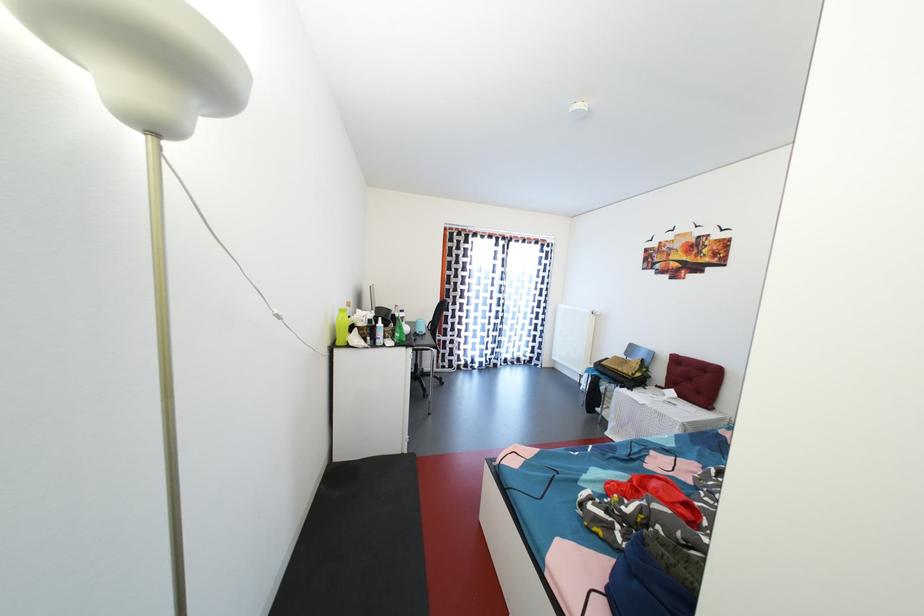
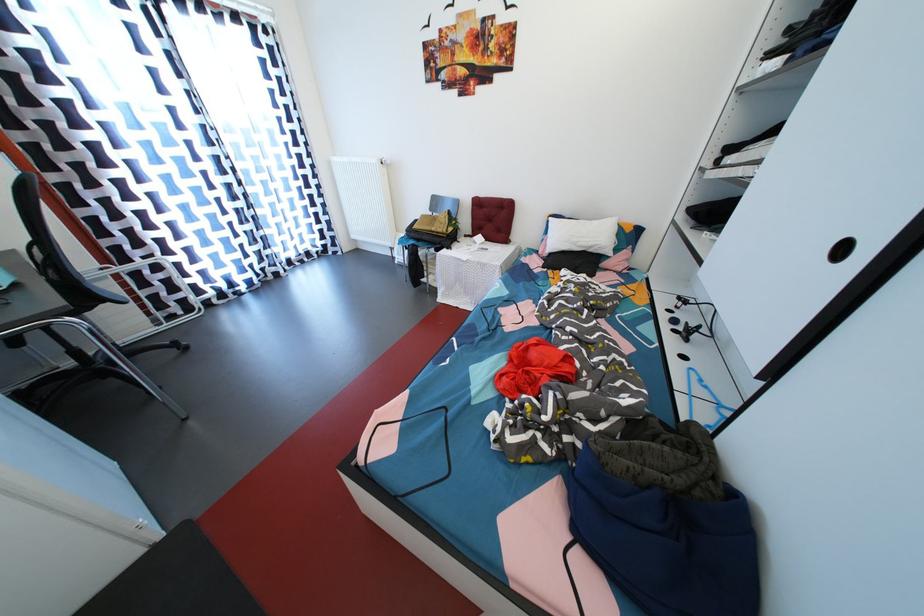
The point at (x=688, y=359) is marked in the first image. Where is the corresponding point in the second image?

(489, 200)